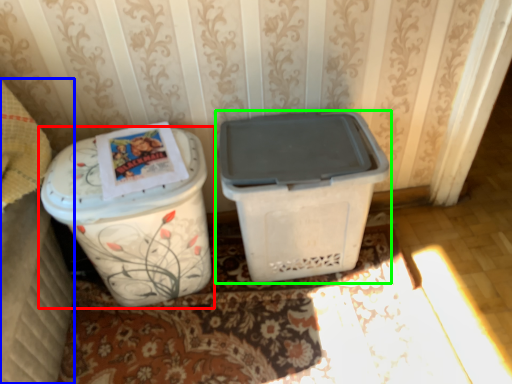
Question: Estimate the real-world distances between objects in this image. Which object is farther from waste container (highlighted by a red box), leftover (highlighted by a blue box) or waste container (highlighted by a green box)?

Choices:
 (A) leftover
 (B) waste container

Answer: (B)